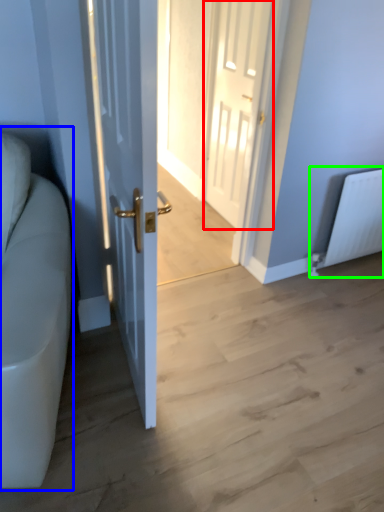
Question: Which object is positioned closest to door (highlighted by a red box)? Select from couch (highlighted by a blue box) and radiator (highlighted by a green box).

Choices:
 (A) couch
 (B) radiator

Answer: (B)